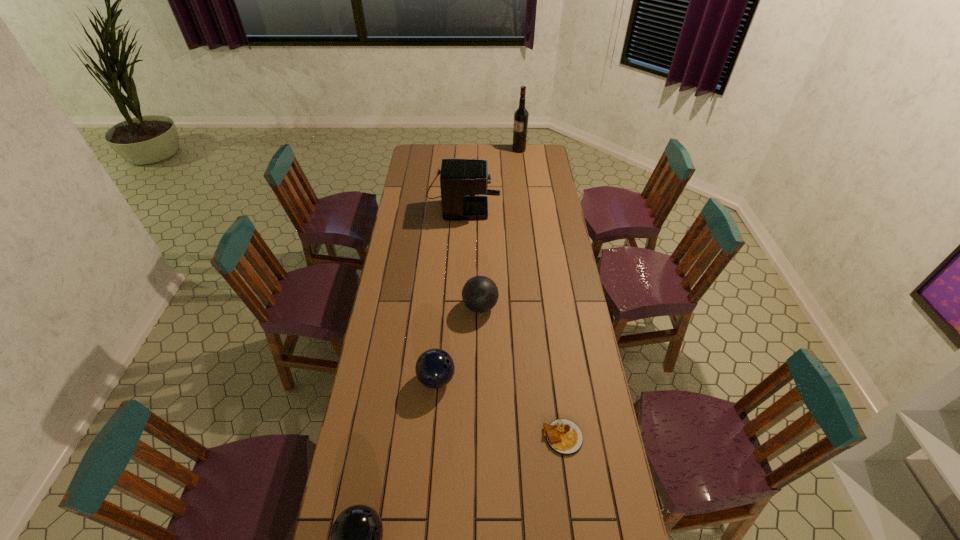
You are a GUI agent. You are given a task and a screenshot of the screen. Output one action in this format:
    pyautogui.click(x=<x>, y=<y>)
    Task: Click on the empty location between the coffee maker and the shortest object
    The width and height of the screenshot is (960, 540).
    Given the screenshot: What is the action you would take?
    pyautogui.click(x=513, y=316)

Locate an element on the screen. The height and width of the screenshot is (540, 960). vacant region between the fifth farthest object and the wine bottle is located at coordinates (540, 293).

This screenshot has width=960, height=540. I want to click on free spot between the shortest object and the fifth nearest object, so click(x=513, y=316).

Image resolution: width=960 pixels, height=540 pixels. What are the coordinates of `vacant point located between the shortest object and the fifth nearest object` in the screenshot? It's located at (513, 316).

Where is `vacant space in between the farthest object and the second farthest bowling ball`? vacant space in between the farthest object and the second farthest bowling ball is located at coordinates (478, 265).

Where is `the third closest object to the second nearest bowling ball`? the third closest object to the second nearest bowling ball is located at coordinates (356, 535).

At what (x,y) coordinates should I click in order to perform the action: click on object that ranks as the closest to the second farthest bowling ball. Please return your answer as a coordinate pair (x, y). Looking at the image, I should click on (480, 294).

Choose which bowling ball is the third nearest neighbor to the tallest object. Please provide its 2D coordinates. Your answer should be formatted as a tuple, i.e. [(x, y)], where the tuple contains the x and y coordinates of a point satisfying the conditions above.

[(356, 535)]

Identify which bowling ball is located as the nearest to the fifth nearest object. Please provide its 2D coordinates. Your answer should be formatted as a tuple, i.e. [(x, y)], where the tuple contains the x and y coordinates of a point satisfying the conditions above.

[(480, 294)]

Identify the location of free spot that satisfies the following two spatial constraints: 1. on the surface of the fourth farthest object near the finger holes; 2. on the left side of the shortest object. (432, 437).